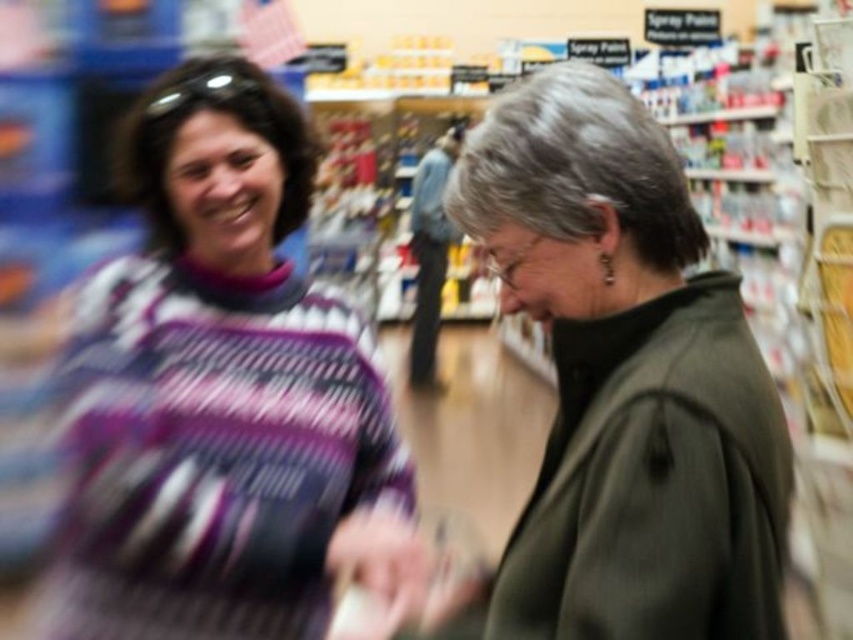
Image resolution: width=853 pixels, height=640 pixels. What do you see at coordinates (221, 390) in the screenshot? I see `purple knitted sweater at left` at bounding box center [221, 390].

Between purple knitted sweater at left and dark green jacket at center, which one has less height?

dark green jacket at center

At what (x,y) coordinates should I click in order to perform the action: click on purple knitted sweater at left. Please return your answer as a coordinate pair (x, y). This screenshot has height=640, width=853. Looking at the image, I should click on (221, 390).